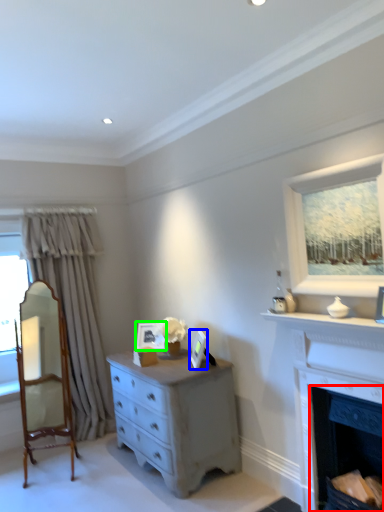
Question: Which is nearer to the fireplace (highlighted by a red box)? picture frame (highlighted by a blue box) or picture frame (highlighted by a green box).

Choices:
 (A) picture frame
 (B) picture frame

Answer: (A)